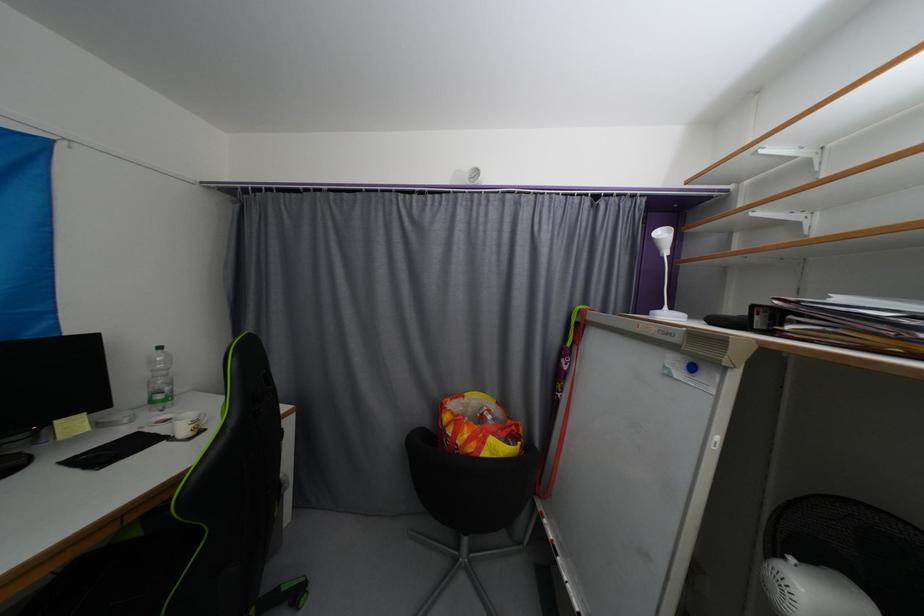
Which object does [160,379] point to?

This point indicates the plastic water bottle.